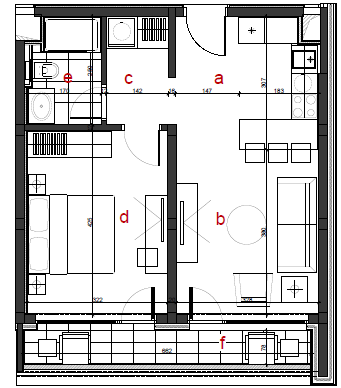
Identify the location of chair. (298, 223), (256, 284), (255, 155), (278, 156), (300, 156).